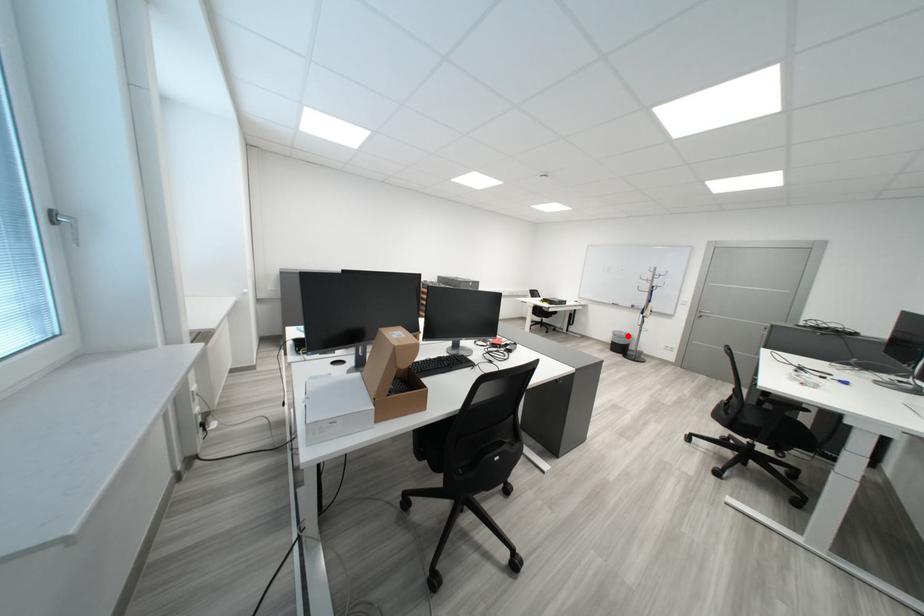
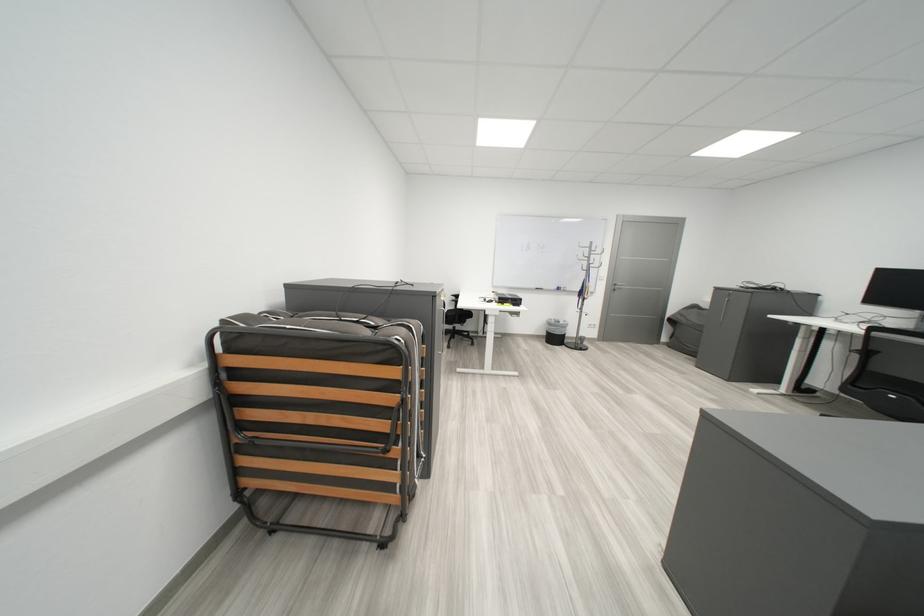
Where in the second image is the point corresponding to the highlighted location from the first image?

(563, 326)